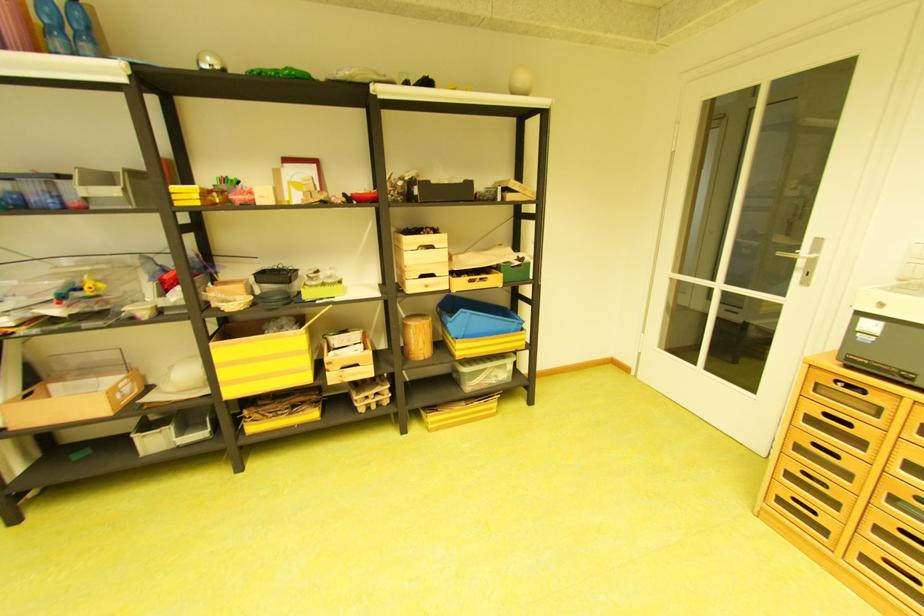
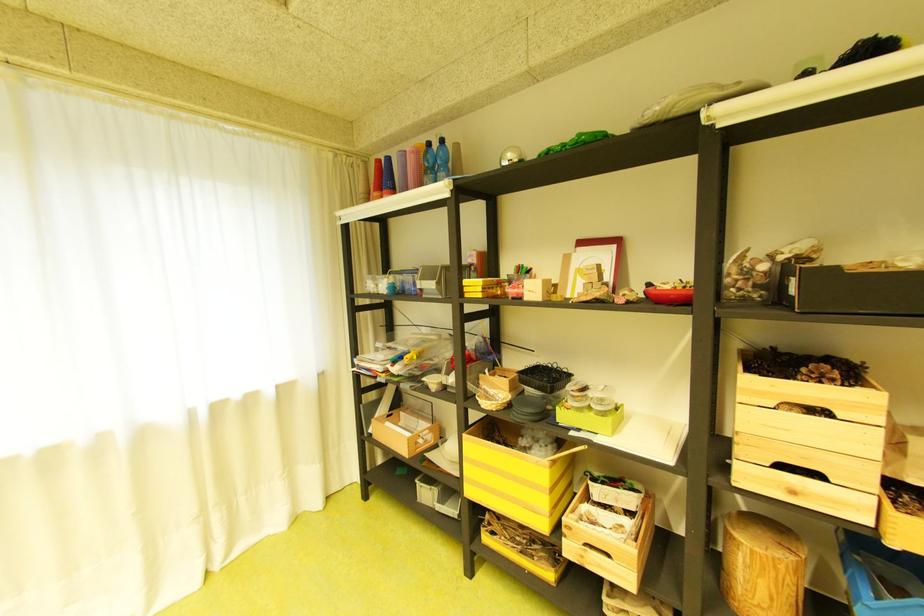
Question: The camera is either moving clockwise (left) or counter-clockwise (right) around the object. The first image is from the beginning of the video and the second image is from the end. Is the camera moving left or right when shooting the video?

Choices:
 (A) Left
 (B) Right

Answer: (B)